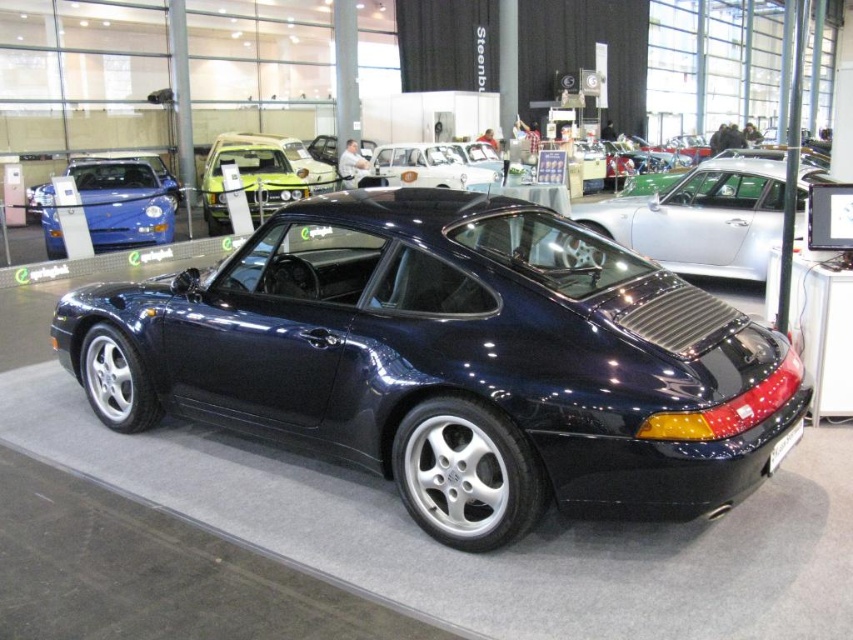
You are a photographer at a car exhibition. You need to capture both the glossy dark blue car at center and the matte blue sedan at left in a single shot. Which car should you position closer to the camera to ensure both fit in the frame?

You should position the matte blue sedan at left closer to the camera because it is smaller than the glossy dark blue car at center, allowing both to fit within the frame more easily.

Consider the image. You are a photographer at a car exhibition. You need to capture both the glossy dark blue car at center and the matte green car at center in a single frame. Which car should you move closer to the camera to ensure both fit in the frame?

You should move the glossy dark blue car at center closer to the camera because it is smaller than the matte green car at center, so bringing it forward will help balance their sizes in the photo.